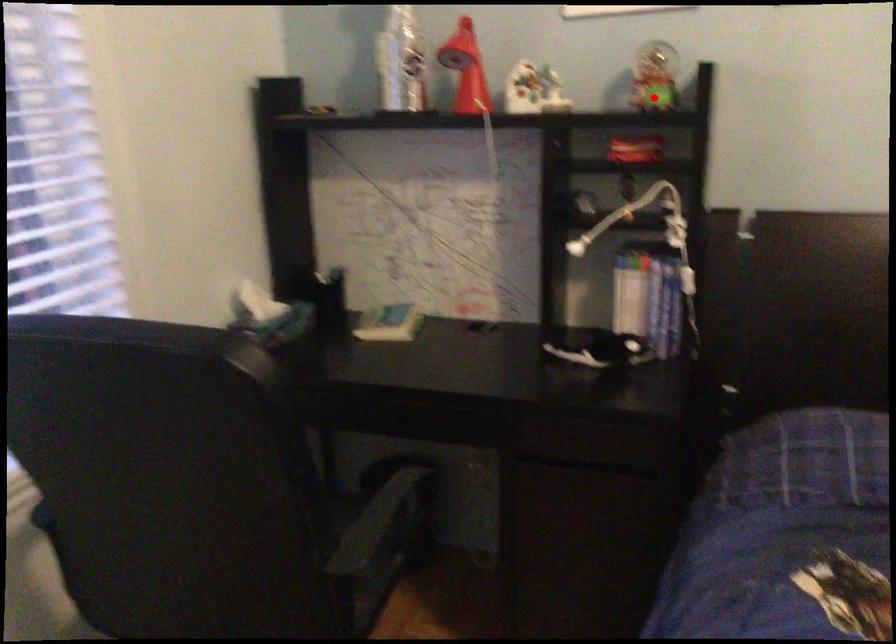
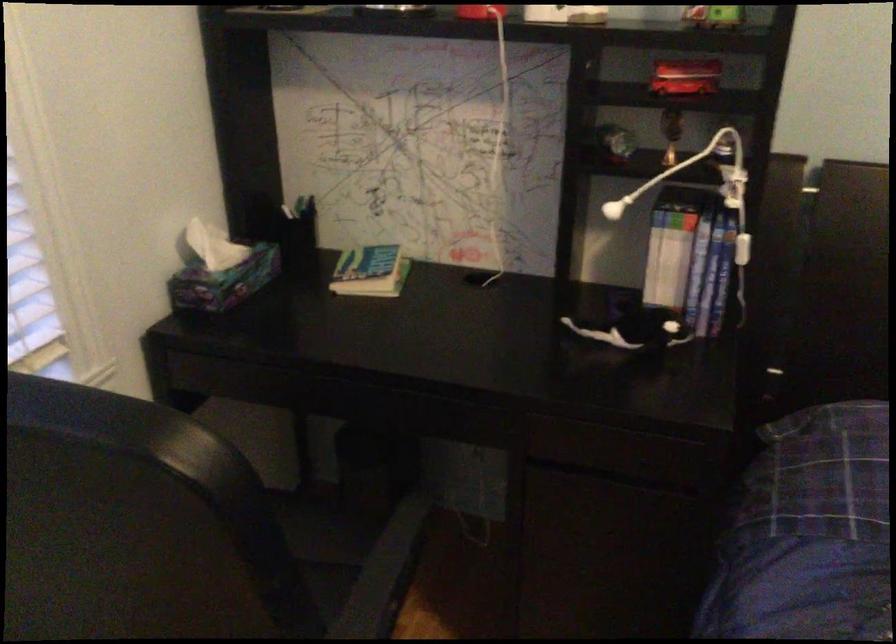
Question: A red point is marked in image1. In image2, is the corresponding 3D point closer to the camera or farther? Reply with the corresponding letter.

Choices:
 (A) The corresponding 3D point is closer.
 (B) The corresponding 3D point is farther.

Answer: (A)